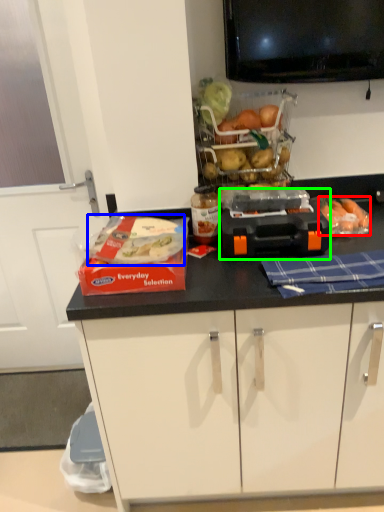
Question: Considering the real-world distances, which object is farthest from food (highlighted by a red box)? food (highlighted by a blue box) or appliance (highlighted by a green box)?

Choices:
 (A) food
 (B) appliance

Answer: (A)